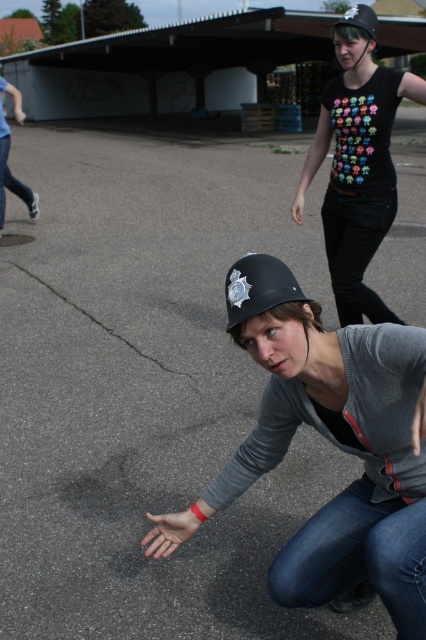
Question: Is matte black helmet at center in front of black matte helmet at center?

Choices:
 (A) yes
 (B) no

Answer: (A)

Question: Among these points, which one is nearest to the camera?

Choices:
 (A) (253, 257)
 (B) (347, 17)
 (C) (354, 19)

Answer: (A)

Question: Can you confirm if matte black helmet at center is wider than black matte t-shirt at upper right?

Choices:
 (A) no
 (B) yes

Answer: (B)

Question: Which point appears closest to the camera in this image?

Choices:
 (A) (371, 12)
 (B) (258, 276)

Answer: (B)

Question: Is black matte t-shirt at upper right bigger than black matte helmet at upper center?

Choices:
 (A) yes
 (B) no

Answer: (B)

Question: Which of the following is the closest to the observer?

Choices:
 (A) (403, 404)
 (B) (227, 300)
 (C) (359, 58)

Answer: (B)